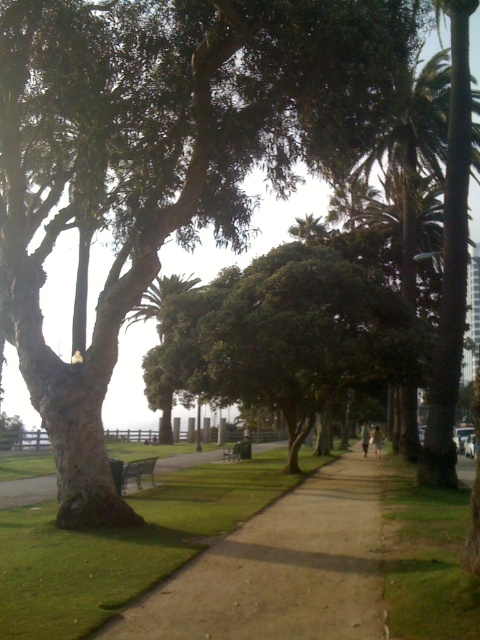
Between brown dirt path at center and green leafy palm tree at center, which one has more height?

Standing taller between the two is green leafy palm tree at center.

What do you see at coordinates (280, 570) in the screenshot?
I see `brown dirt path at center` at bounding box center [280, 570].

At what (x,y) coordinates should I click in order to perform the action: click on brown dirt path at center. Please return your answer as a coordinate pair (x, y). The image size is (480, 640). Looking at the image, I should click on (280, 570).

Is brown dirt path at center below metallic silver bench at center?

Incorrect, brown dirt path at center is not positioned below metallic silver bench at center.

Find the location of a particular element. brown dirt path at center is located at coordinates (280, 570).

The width and height of the screenshot is (480, 640). In order to click on brown dirt path at center in this screenshot , I will do coord(280,570).

Between point (51, 99) and point (344, 324), which one is positioned behind?

Point (344, 324)

Between green rough bark tree at center and green leafy tree at center, which one is positioned lower?

green leafy tree at center

The width and height of the screenshot is (480, 640). What do you see at coordinates (162, 161) in the screenshot? I see `green rough bark tree at center` at bounding box center [162, 161].

You are a GUI agent. You are given a task and a screenshot of the screen. Output one action in this format:
    pyautogui.click(x=<x>, y=<y>)
    Task: Click on the green rough bark tree at center
    The image size is (480, 640).
    Given the screenshot: What is the action you would take?
    pyautogui.click(x=162, y=161)